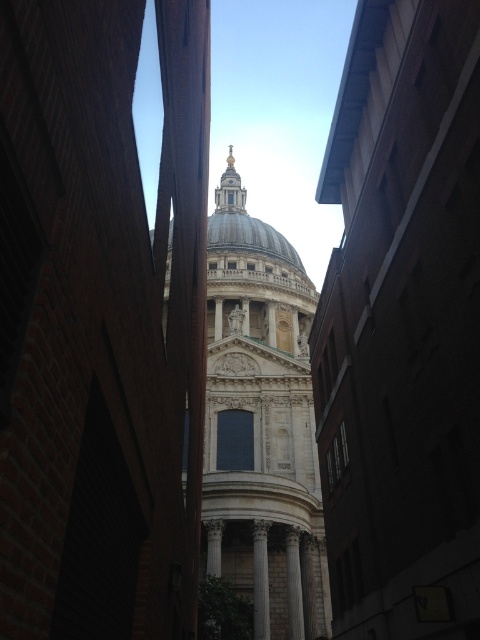
You are an architect planning to add a new sculpture between the white stone church at center and the white marble dome at center. Given their widths, which one should the sculpture be placed closer to so it doesn

The white stone church at center is narrower than the white marble dome at center. Therefore, the sculpture should be placed closer to the white marble dome at center to balance the composition.

You are a photographer planning to take a photo of the white stone church at center and the white marble dome at center from the ground level. Based on their heights, which one should appear taller in your photo?

The white stone church at center is taller than the white marble dome at center, so it will appear taller in the photo.

You are a tourist standing at the base of St. Pauls Cathedral. You notice the white marble dome at center and the white marble pillar at center. Which object is taller?

The white marble dome at center is much taller than the white marble pillar at center.